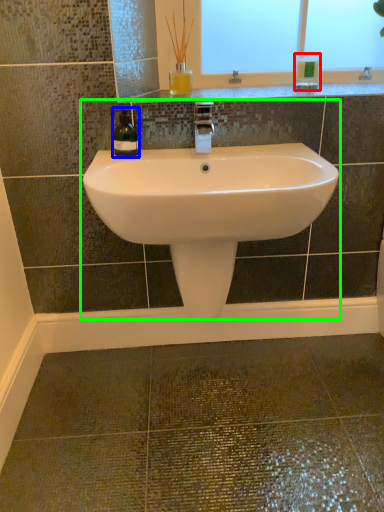
Question: Which object is the closest to the toiletry (highlighted by a red box)? Choose among these: wine bottle (highlighted by a blue box) or sink (highlighted by a green box).

Choices:
 (A) wine bottle
 (B) sink

Answer: (B)